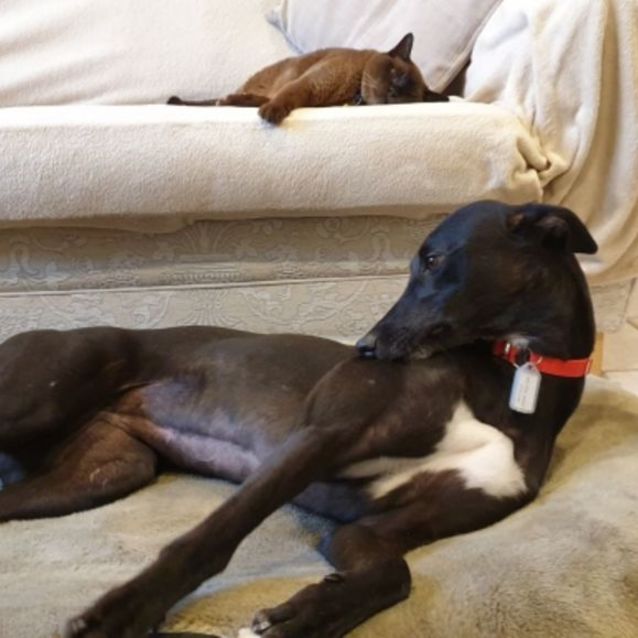
The height and width of the screenshot is (638, 638). I want to click on white draped blanket, so click(574, 23).